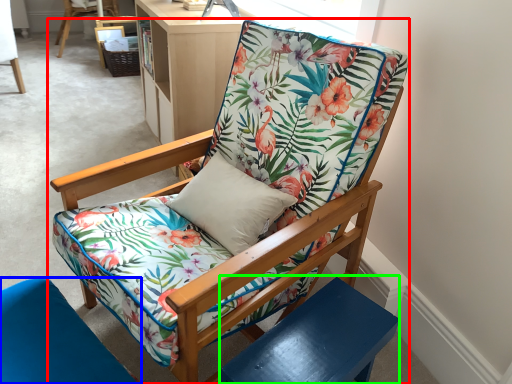
Question: Considering the real-world distances, which object is closest to chair (highlighted by a red box)? chair (highlighted by a blue box) or side table (highlighted by a green box).

Choices:
 (A) chair
 (B) side table

Answer: (B)